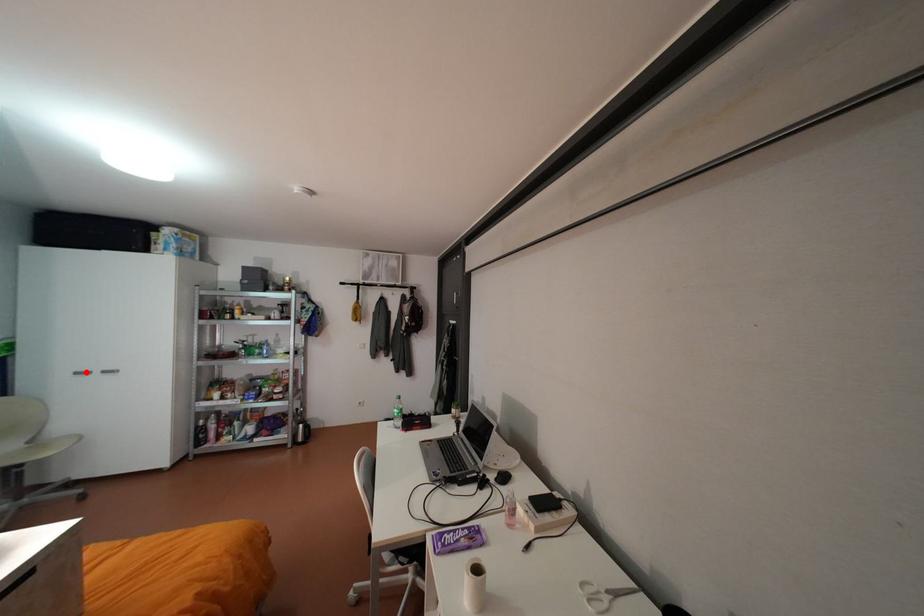
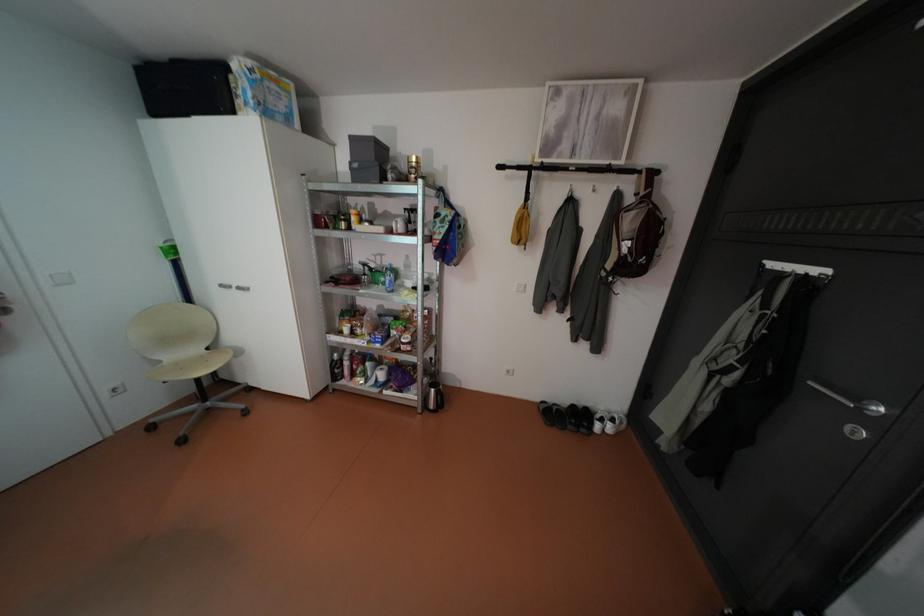
Where in the second image is the point corresponding to the highlighted location from the first image?

(232, 285)